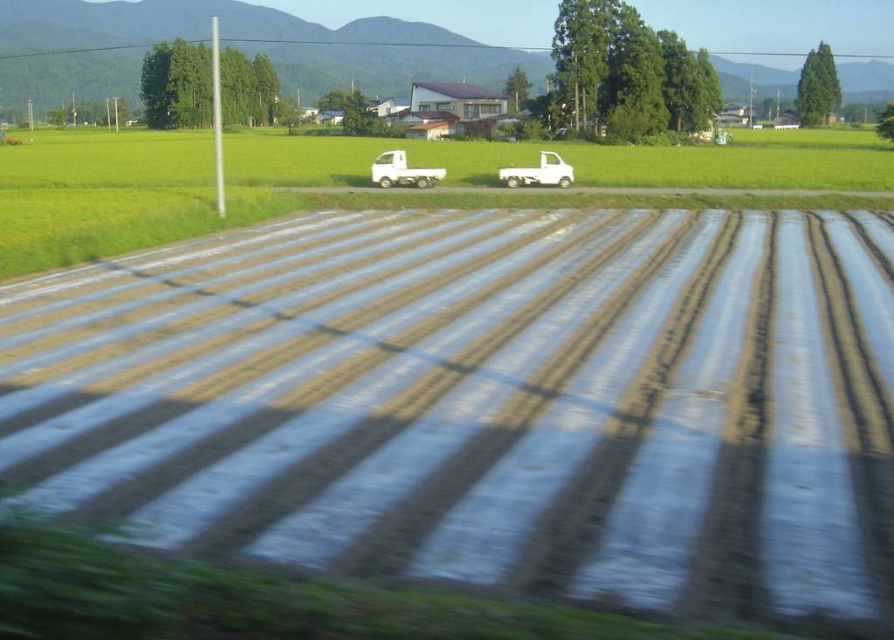
Does clear plastic field at center have a greater width compared to white matte truck at center?

Yes.

The width and height of the screenshot is (894, 640). What do you see at coordinates (343, 179) in the screenshot? I see `clear plastic field at center` at bounding box center [343, 179].

This screenshot has width=894, height=640. I want to click on clear plastic field at center, so click(x=343, y=179).

Who is positioned more to the left, clear plastic field at center or white plastic truck at center?

Positioned to the left is white plastic truck at center.

Does point (85, 232) come in front of point (384, 182)?

That is True.

The image size is (894, 640). Identify the location of clear plastic field at center. (343, 179).

Does point (796, 132) come in front of point (393, 180)?

No, (796, 132) is behind (393, 180).

At what (x,y) coordinates should I click in order to perform the action: click on green grass field at center. Please return your answer as a coordinate pair (x, y). Looking at the image, I should click on (578, 161).